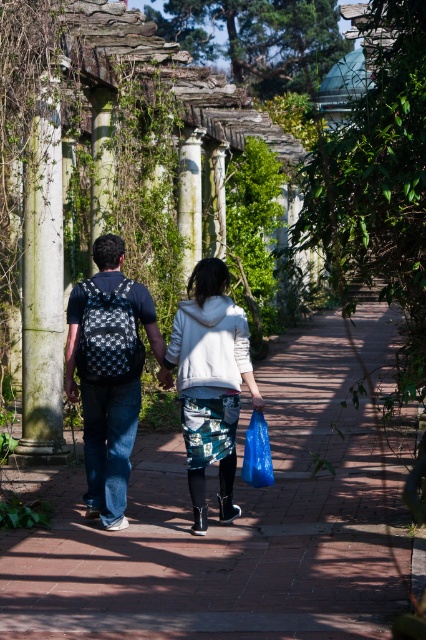
You are a photographer trying to capture both the matte black backpack at center and the blue plastic bag at center in a single frame. Which object should you focus on first to ensure both are in the frame?

The matte black backpack at center is larger in size than the blue plastic bag at center, so you should focus on the matte black backpack at center first to ensure both objects are in the frame.

You are a photographer positioned at the end of the brick pathway. You want to capture both the white fleece jacket at center and the white stone column at left in a single frame. Which object should you zoom in on to ensure both are clearly visible?

You should zoom in on the white stone column at left because its narrower width compared to the white fleece jacket at center will allow both to fit within the frame more easily.